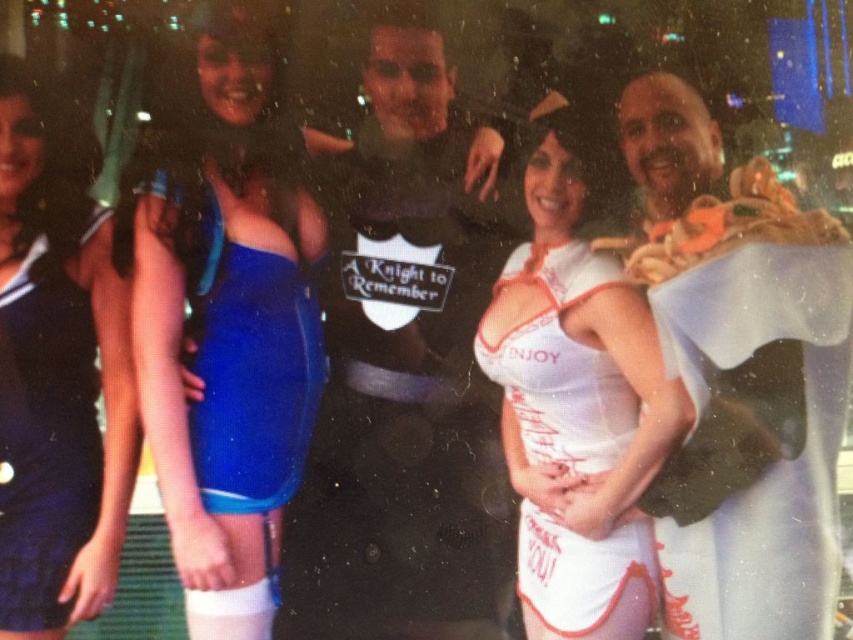
Who is taller, matte black t-shirt at center or blue satin dress at center?

Standing taller between the two is matte black t-shirt at center.

Does point (375, 572) lie in front of point (253, 266)?

No.

At what (x,y) coordinates should I click in order to perform the action: click on matte black t-shirt at center. Please return your answer as a coordinate pair (x, y). Looking at the image, I should click on (404, 371).

Can you confirm if blue fabric dress at center is positioned to the right of blue satin dress at center?

In fact, blue fabric dress at center is to the left of blue satin dress at center.

Is blue fabric dress at center wider than blue satin dress at center?

Indeed, blue fabric dress at center has a greater width compared to blue satin dress at center.

Which is in front, point (248, 435) or point (250, 392)?

Point (248, 435) is in front.

Where is `blue fabric dress at center`? blue fabric dress at center is located at coordinates (x=229, y=330).

Is white satin dress at center shorter than blue satin dress at center?

No, white satin dress at center is not shorter than blue satin dress at center.

Is white satin dress at center smaller than blue satin dress at center?

Actually, white satin dress at center might be larger than blue satin dress at center.

What do you see at coordinates (577, 401) in the screenshot?
I see `white satin dress at center` at bounding box center [577, 401].

This screenshot has height=640, width=853. In order to click on white satin dress at center in this screenshot , I will do `click(577, 401)`.